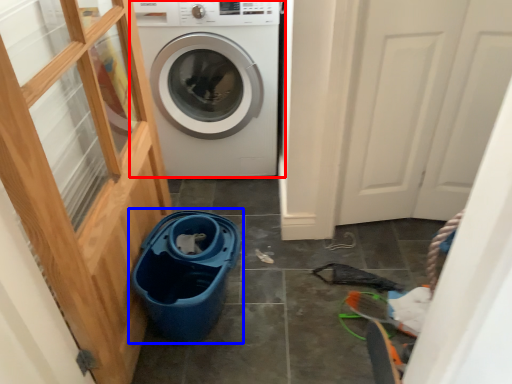
Question: Which point is further to the camera, washing machine (highlighted by a red box) or recycling bin (highlighted by a blue box)?

Choices:
 (A) washing machine
 (B) recycling bin

Answer: (A)